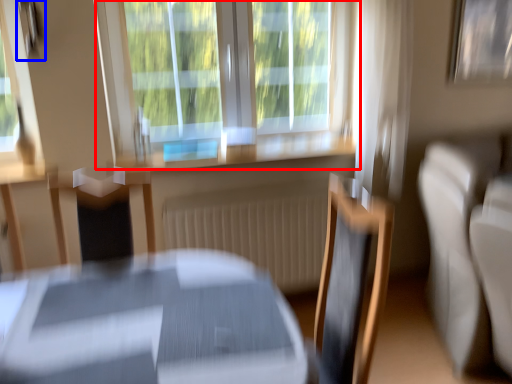
Question: Among these objects, which one is nearest to the camera, window (highlighted by a red box) or picture frame (highlighted by a blue box)?

Choices:
 (A) window
 (B) picture frame

Answer: (B)